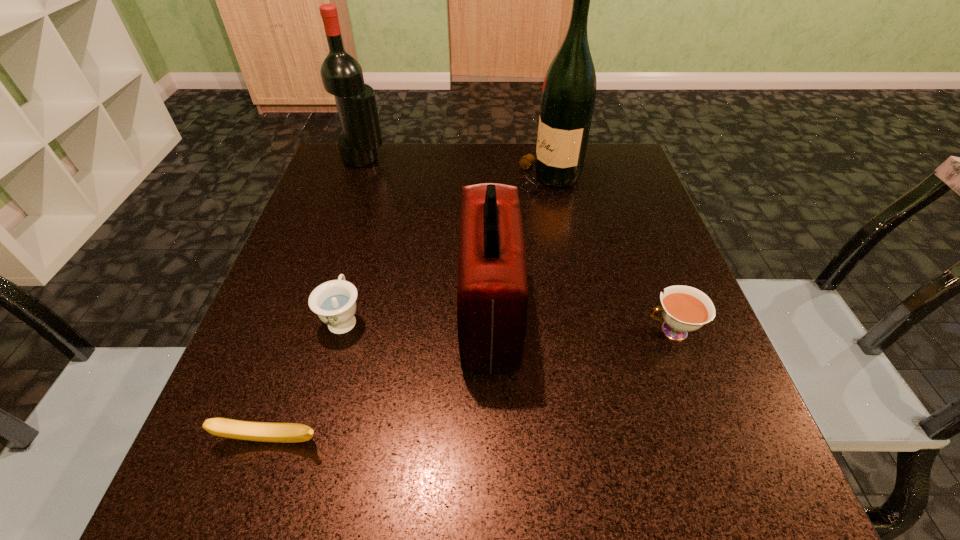
You are a GUI agent. You are given a task and a screenshot of the screen. Output one action in this format:
    pyautogui.click(x=<x>, y=<y>)
    Task: Click on the object situated at the near left corner
    The image size is (960, 540).
    Given the screenshot: What is the action you would take?
    pyautogui.click(x=236, y=429)

You are a GUI agent. You are given a task and a screenshot of the screen. Output one action in this format:
    pyautogui.click(x=<x>, y=<y>)
    Task: Click on the object that is at the far right corner
    
    Given the screenshot: What is the action you would take?
    pyautogui.click(x=568, y=97)

Find the location of a particular element. Image resolution: width=960 pixels, height=540 pixels. free region at the far edge of the desktop is located at coordinates (519, 195).

This screenshot has height=540, width=960. Find the location of `free space at the near edge of the desktop`. free space at the near edge of the desktop is located at coordinates (576, 484).

In the image, there is a desktop. At what (x,y) coordinates should I click in order to perform the action: click on vacant space at the left edge. Please return your answer as a coordinate pair (x, y). The height and width of the screenshot is (540, 960). Looking at the image, I should click on (250, 441).

Image resolution: width=960 pixels, height=540 pixels. What are the coordinates of `vacant region at the right edge of the desktop` in the screenshot? It's located at (660, 318).

Where is `vacant space at the far left corner of the desktop`? This screenshot has height=540, width=960. vacant space at the far left corner of the desktop is located at coordinates (337, 154).

Locate an element on the screen. This screenshot has width=960, height=540. vacant region at the near right corner is located at coordinates pyautogui.click(x=718, y=471).

The width and height of the screenshot is (960, 540). I want to click on unoccupied position between the nearest object and the third tallest object, so click(x=380, y=377).

I want to click on free point between the fourth object from left to right and the banana, so click(380, 377).